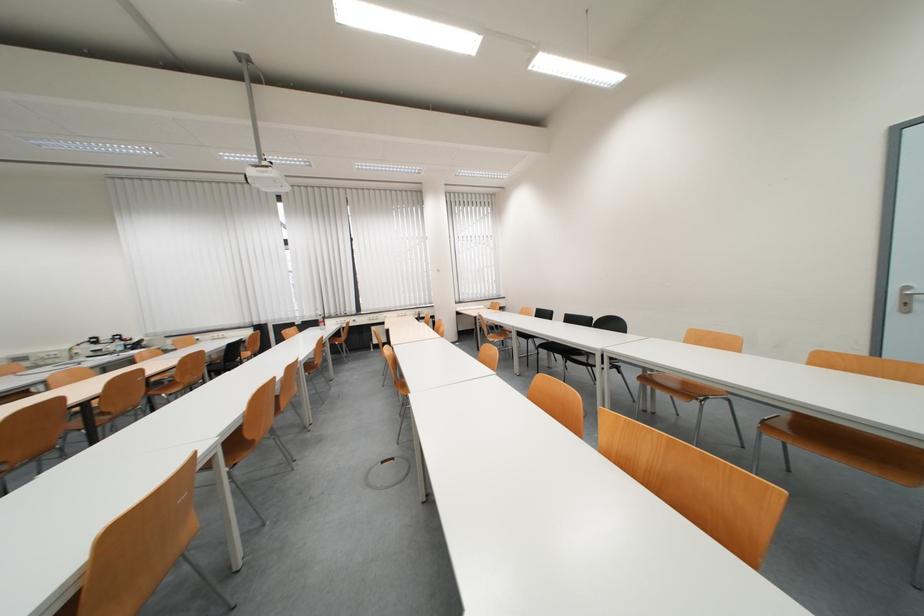
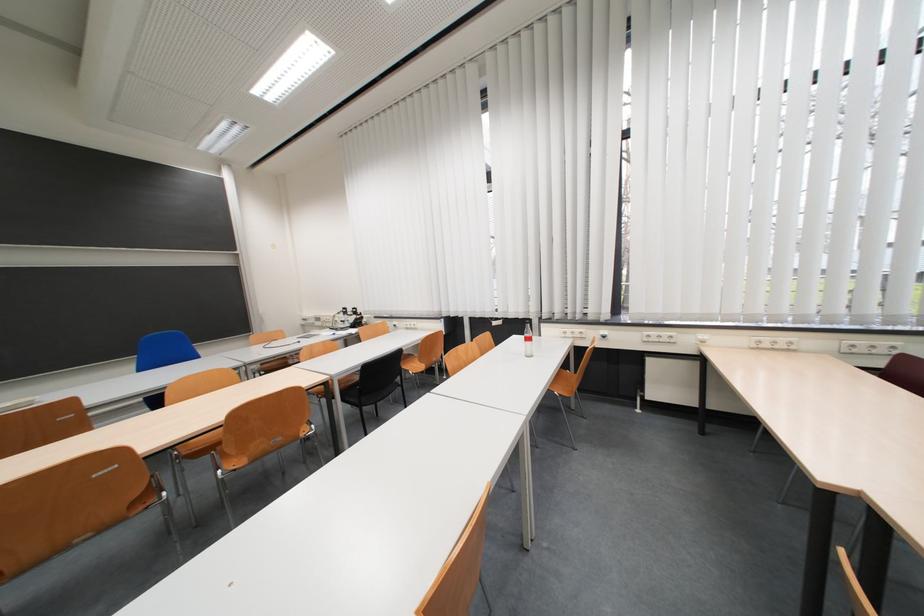
In the second image, find the point that corresponds to point 113,342 in the first image.

(357, 315)